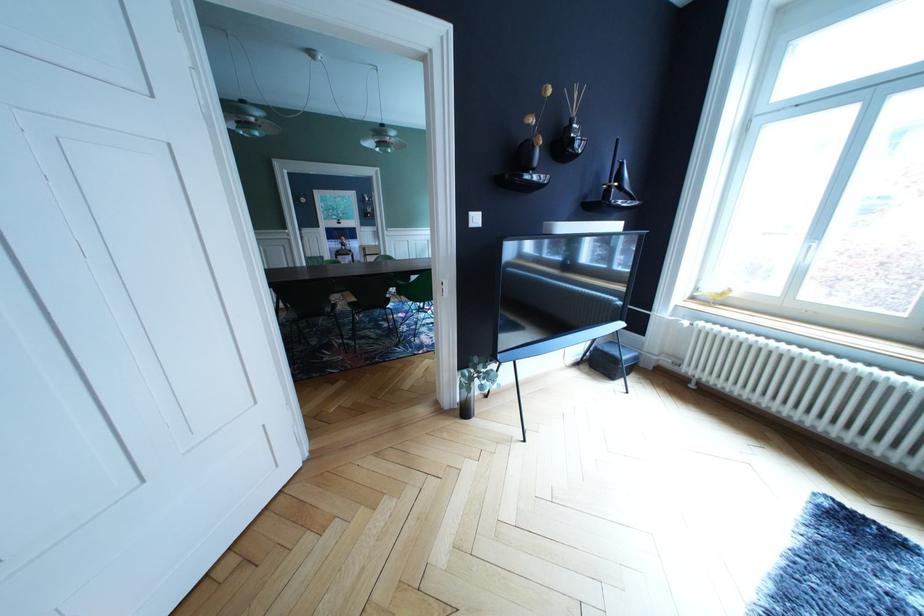
Find the location of a particular element. The image size is (924, 616). white light switch is located at coordinates [475, 219].